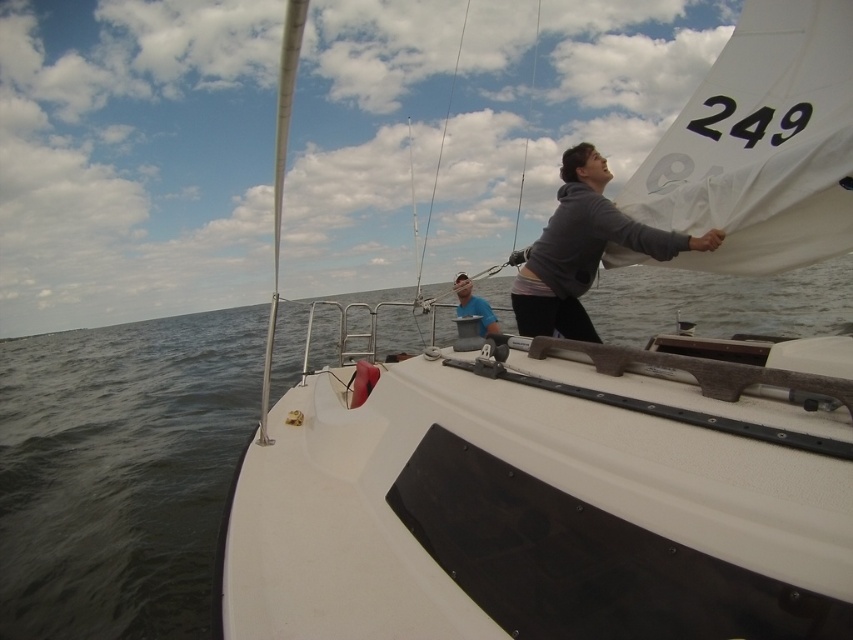
Is white matte sailboat at center bigger than blue fabric bucket at center?

Correct, white matte sailboat at center is larger in size than blue fabric bucket at center.

Is white matte sailboat at center wider than blue fabric bucket at center?

Yes.

Is point (705, 500) farther from camera compared to point (465, 294)?

No, it is in front of (465, 294).

Where is `white matte sailboat at center`? The width and height of the screenshot is (853, 640). white matte sailboat at center is located at coordinates (549, 492).

Looking at this image, can you confirm if gray matte hoodie at center is positioned to the right of blue fabric bucket at center?

Yes, gray matte hoodie at center is to the right of blue fabric bucket at center.

Can you confirm if gray matte hoodie at center is smaller than blue fabric bucket at center?

Incorrect, gray matte hoodie at center is not smaller in size than blue fabric bucket at center.

Does point (512, 289) lie in front of point (491, 314)?

Yes, it is.

This screenshot has width=853, height=640. Find the location of `gray matte hoodie at center`. gray matte hoodie at center is located at coordinates (583, 250).

Is point (607, 388) more distant than point (567, 208)?

That is False.

Image resolution: width=853 pixels, height=640 pixels. What do you see at coordinates (549, 492) in the screenshot?
I see `white matte sailboat at center` at bounding box center [549, 492].

Does point (229, 600) lie behind point (558, 276)?

No, (229, 600) is in front of (558, 276).

At what (x,y) coordinates should I click in order to perform the action: click on white matte sailboat at center. Please return your answer as a coordinate pair (x, y). Looking at the image, I should click on (549, 492).